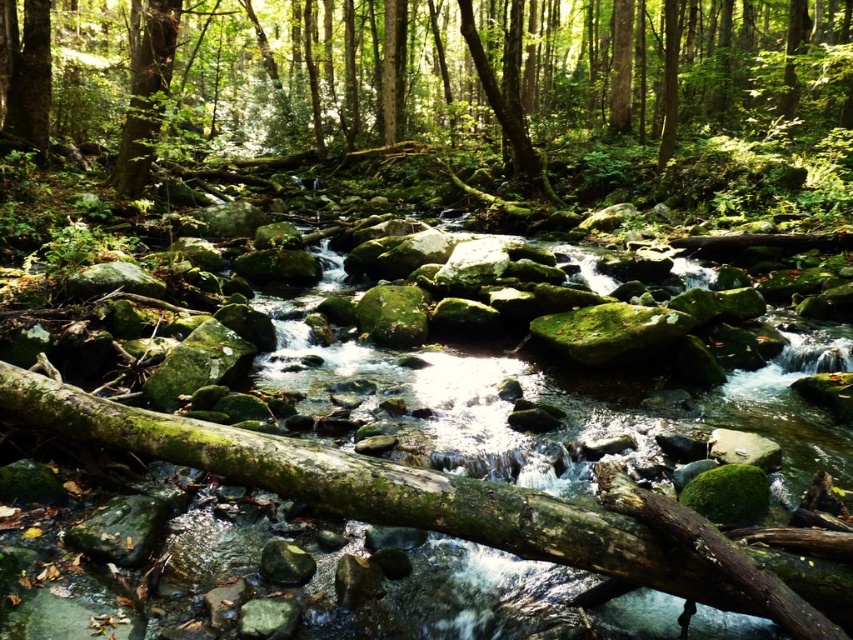
The height and width of the screenshot is (640, 853). Describe the element at coordinates (456, 90) in the screenshot. I see `green mossy rock at center` at that location.

Between green mossy rock at center and green mossy rocks at center, which one appears on the right side from the viewer's perspective?

Positioned to the right is green mossy rocks at center.

Is point (258, 58) farther from camera compared to point (532, 618)?

Yes, it is behind point (532, 618).

Find the location of a particular element. The image size is (853, 640). green mossy rock at center is located at coordinates (456, 90).